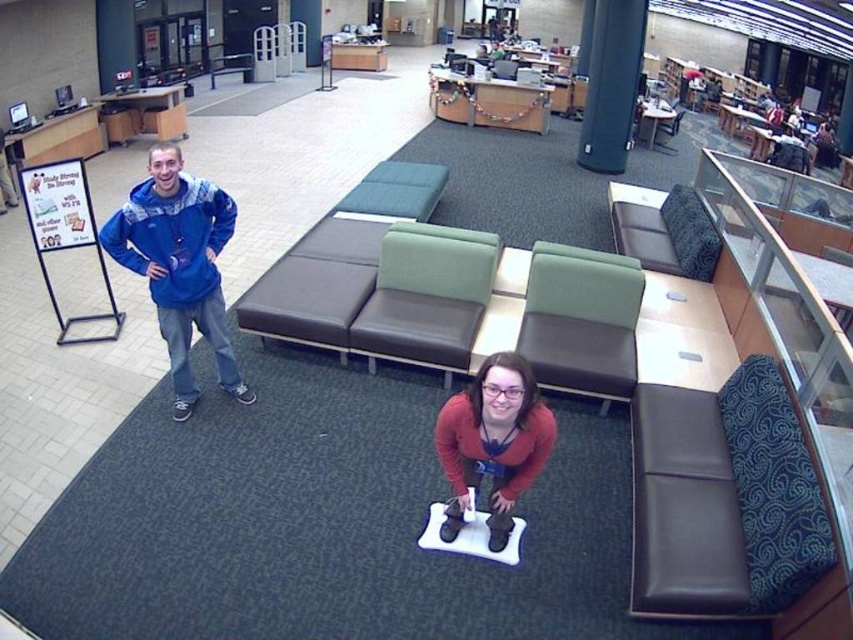
In the scene shown: How much distance is there between blue fleece jacket at left and matte red sweater at center?

The distance of blue fleece jacket at left from matte red sweater at center is 1.50 meters.

Based on the photo, between blue fleece jacket at left and matte red sweater at center, which one appears on the right side from the viewer's perspective?

matte red sweater at center

The height and width of the screenshot is (640, 853). What are the coordinates of `blue fleece jacket at left` in the screenshot? It's located at (178, 266).

Does green leather couch at center have a lesser height compared to matte red sweater at center?

In fact, green leather couch at center may be taller than matte red sweater at center.

Is point (381, 356) closer to camera compared to point (505, 428)?

No, (381, 356) is further to viewer.

What are the coordinates of `green leather couch at center` in the screenshot? It's located at (427, 296).

Describe the element at coordinates (427, 296) in the screenshot. I see `green leather couch at center` at that location.

Is green leather couch at center further to camera compared to green fabric couch at center?

Yes, green leather couch at center is behind green fabric couch at center.

This screenshot has width=853, height=640. What do you see at coordinates (427, 296) in the screenshot? I see `green leather couch at center` at bounding box center [427, 296].

Locate an element on the screen. The image size is (853, 640). green leather couch at center is located at coordinates (427, 296).